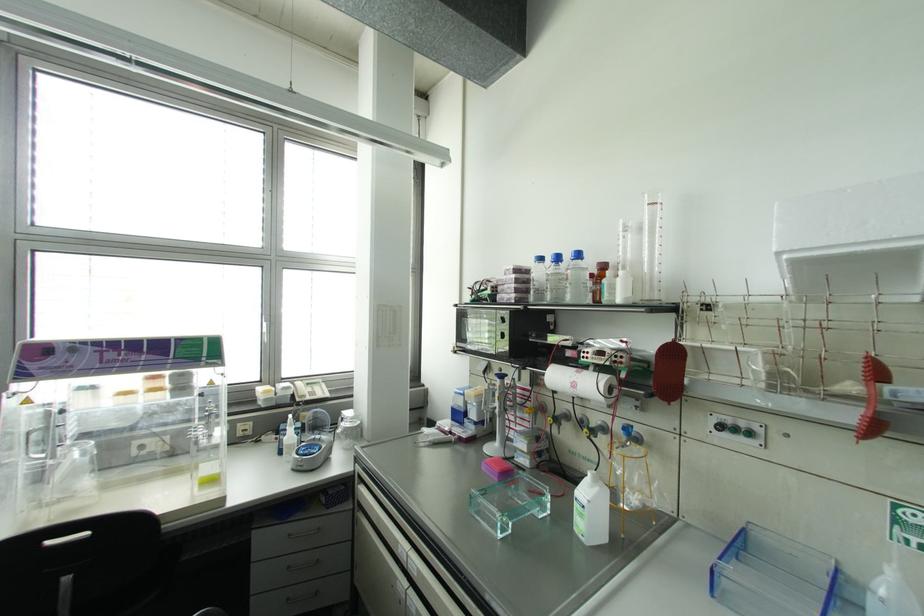
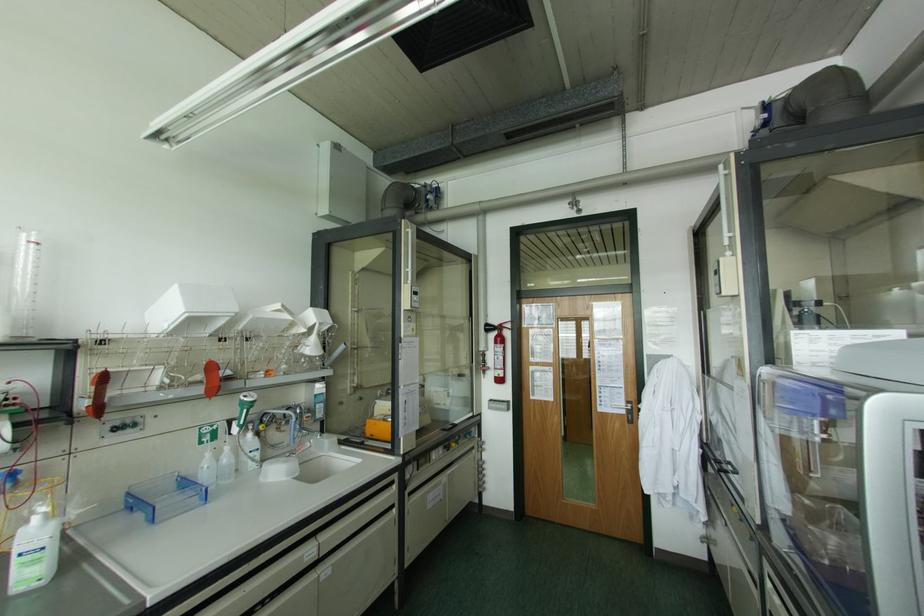
Find the pixel in the second image that matches point 672,353 in the first image.

(102, 379)